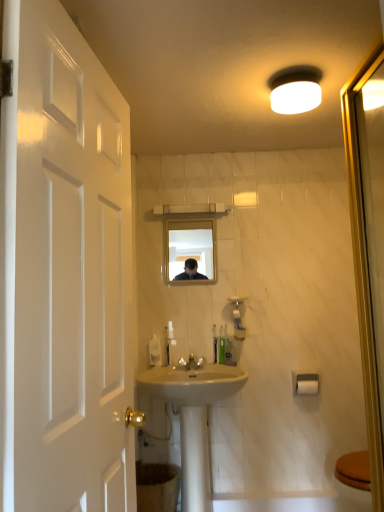
Locate an element on the screen. This screenshot has width=384, height=512. free spot to the left of white glossy faucet at center is located at coordinates (160, 370).